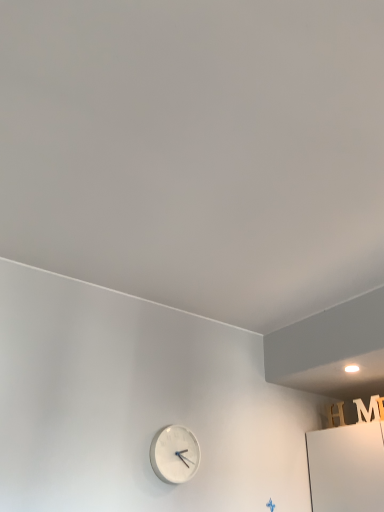
Question: From the image's perspective, is white matte clock at lower center located above or below white matte letter m at upper right?

Choices:
 (A) below
 (B) above

Answer: (A)

Question: In the image, is white matte clock at lower center positioned in front of or behind white matte letter m at upper right?

Choices:
 (A) front
 (B) behind

Answer: (A)

Question: Is point (187, 475) closer or farther from the camera than point (370, 398)?

Choices:
 (A) closer
 (B) farther

Answer: (A)

Question: Based on their sizes in the image, would you say white matte letter m at upper right is bigger or smaller than white matte clock at lower center?

Choices:
 (A) big
 (B) small

Answer: (B)

Question: Choose the correct answer: Is white matte letter m at upper right inside white matte clock at lower center or outside it?

Choices:
 (A) inside
 (B) outside

Answer: (B)

Question: In terms of height, does white matte letter m at upper right look taller or shorter compared to white matte clock at lower center?

Choices:
 (A) tall
 (B) short

Answer: (B)

Question: Relative to white matte clock at lower center, is white matte letter m at upper right in front or behind?

Choices:
 (A) behind
 (B) front

Answer: (A)